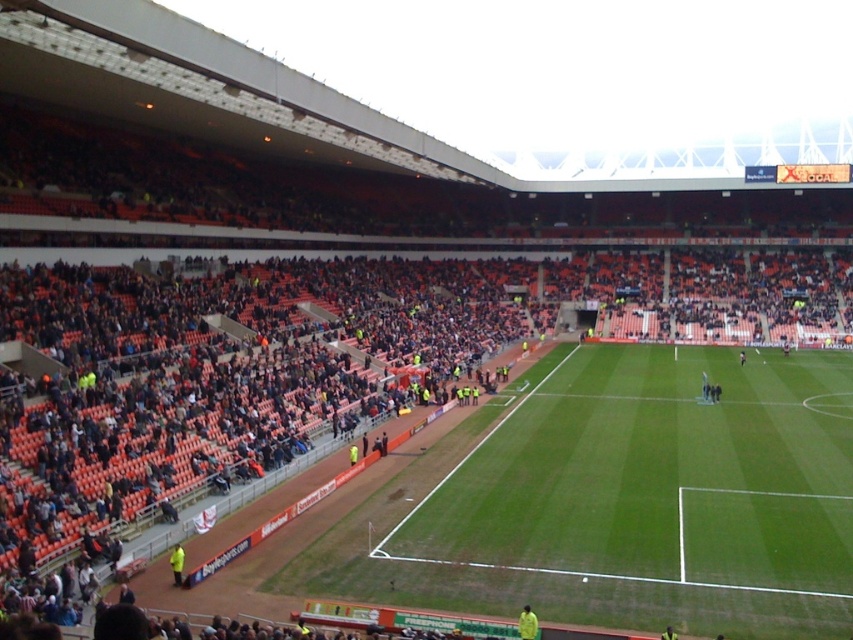
Does green grass football field at center have a greater height compared to yellow jacket at lower left?

Yes, green grass football field at center is taller than yellow jacket at lower left.

Describe the element at coordinates (660, 480) in the screenshot. I see `green grass football field at center` at that location.

Between point (512, 548) and point (180, 556), which one is positioned behind?

The point (512, 548) is more distant.

Find the location of `green grass football field at center`. green grass football field at center is located at coordinates (660, 480).

Looking at this image, can you confirm if green grass football field at center is smaller than yellow matte jacket at lower center?

No.

Which is in front, point (601, 497) or point (526, 604)?

Point (526, 604)

Between point (613, 456) and point (518, 625), which one is positioned in front?

Point (518, 625) is more forward.

Image resolution: width=853 pixels, height=640 pixels. Identify the location of green grass football field at center. click(660, 480).

Is point (527, 632) positioned behind point (170, 557)?

No, (527, 632) is in front of (170, 557).

Is yellow matte jacket at lower center above yellow jacket at lower left?

No, yellow matte jacket at lower center is not above yellow jacket at lower left.

You are a GUI agent. You are given a task and a screenshot of the screen. Output one action in this format:
    pyautogui.click(x=<x>, y=<y>)
    Task: Click on the yellow matte jacket at lower center
    The width and height of the screenshot is (853, 640).
    Given the screenshot: What is the action you would take?
    pyautogui.click(x=527, y=624)

You are a GUI agent. You are given a task and a screenshot of the screen. Output one action in this format:
    pyautogui.click(x=<x>, y=<y>)
    Task: Click on the yellow matte jacket at lower center
    
    Given the screenshot: What is the action you would take?
    pyautogui.click(x=527, y=624)